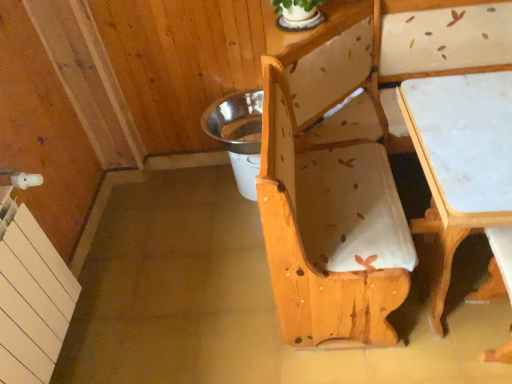
Question: Is white marble table at lower right taller than metallic silver potty at center?

Choices:
 (A) yes
 (B) no

Answer: (A)

Question: From the image's perspective, is white marble table at lower right on top of metallic silver potty at center?

Choices:
 (A) no
 (B) yes

Answer: (A)

Question: Is white marble table at lower right wider than metallic silver potty at center?

Choices:
 (A) no
 (B) yes

Answer: (B)

Question: From the image's perspective, is white marble table at lower right located beneath metallic silver potty at center?

Choices:
 (A) yes
 (B) no

Answer: (A)

Question: Is white marble table at lower right positioned in front of metallic silver potty at center?

Choices:
 (A) no
 (B) yes

Answer: (B)

Question: Considering the positions of metallic silver potty at center and natural wood bench at center in the image, is metallic silver potty at center bigger or smaller than natural wood bench at center?

Choices:
 (A) big
 (B) small

Answer: (B)

Question: From a real-world perspective, is metallic silver potty at center physically located above or below natural wood bench at center?

Choices:
 (A) above
 (B) below

Answer: (B)

Question: Which is correct: metallic silver potty at center is inside natural wood bench at center, or outside of it?

Choices:
 (A) outside
 (B) inside

Answer: (A)

Question: In the image, is metallic silver potty at center positioned in front of or behind natural wood bench at center?

Choices:
 (A) behind
 (B) front

Answer: (A)

Question: Considering the positions of natural wood bench at center and white marble table at lower right in the image, is natural wood bench at center taller or shorter than white marble table at lower right?

Choices:
 (A) short
 (B) tall

Answer: (B)

Question: Is natural wood bench at center wider or thinner than white marble table at lower right?

Choices:
 (A) wide
 (B) thin

Answer: (A)

Question: Which is correct: natural wood bench at center is inside white marble table at lower right, or outside of it?

Choices:
 (A) inside
 (B) outside

Answer: (B)

Question: Considering their positions, is natural wood bench at center located in front of or behind white marble table at lower right?

Choices:
 (A) front
 (B) behind

Answer: (A)

Question: Looking at their shapes, would you say metallic silver potty at center is wider or thinner than white marble table at lower right?

Choices:
 (A) wide
 (B) thin

Answer: (B)

Question: Would you say metallic silver potty at center is to the left or to the right of white marble table at lower right in the picture?

Choices:
 (A) left
 (B) right

Answer: (A)